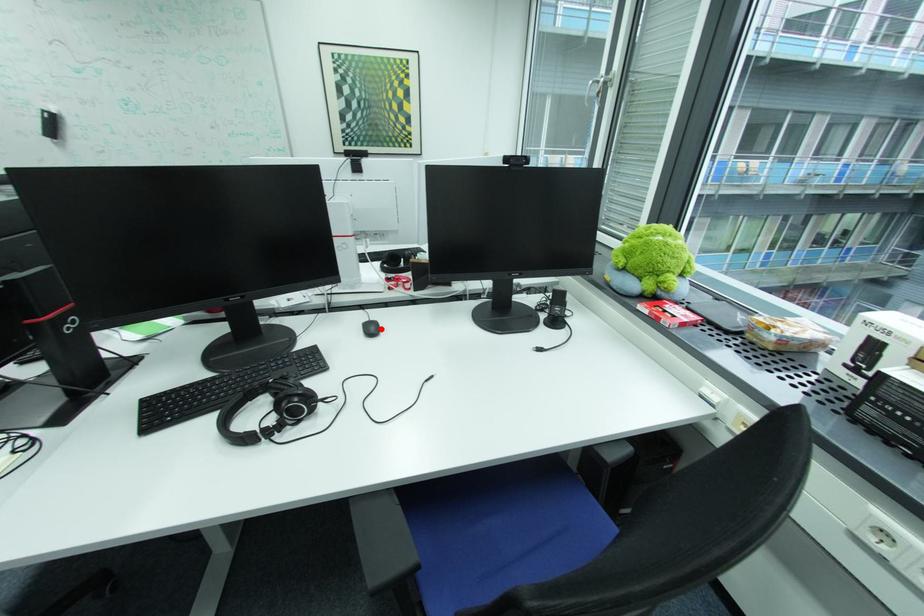
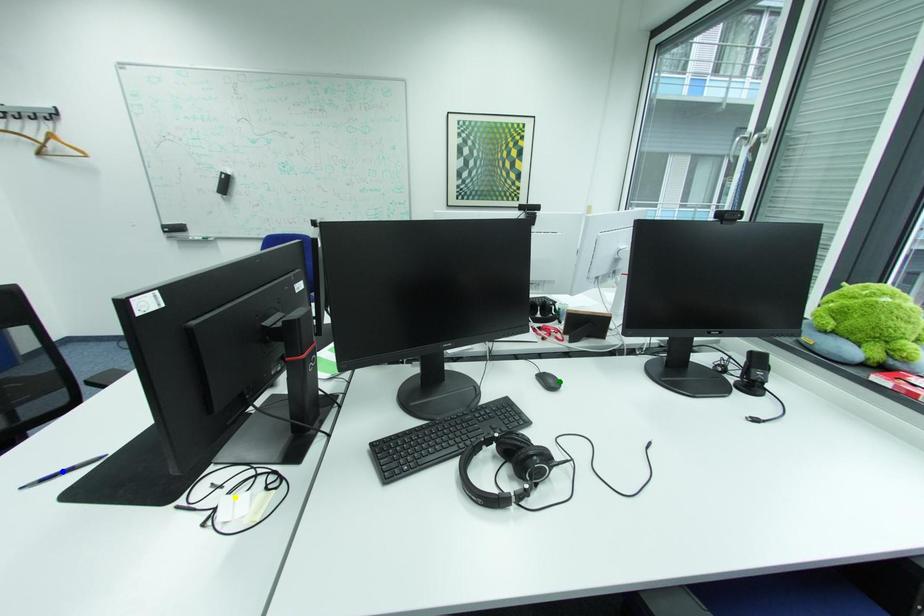
Question: I am providing you with two images of the same scene from different viewpoints. A red point is marked on the first image. You are given multiple points on the second image. Which mark in image 2 goes with the point in image 1?

Choices:
 (A) blue point
 (B) yellow point
 (C) green point

Answer: (C)